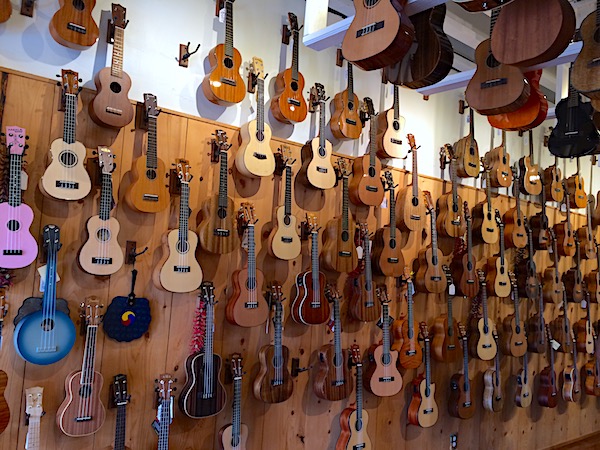
Locate an element on the screen. Image resolution: width=600 pixels, height=450 pixels. white wall is located at coordinates (431, 125).